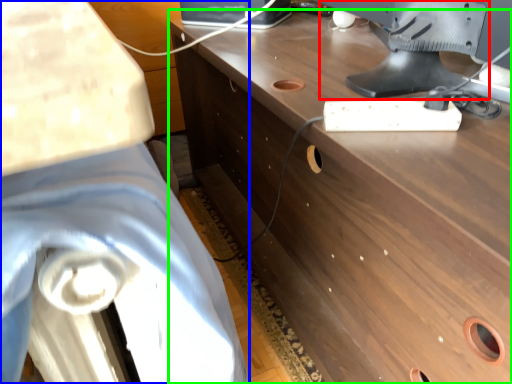
Question: Estimate the real-world distances between objects in this image. Which object is farther from computer monitor (highlighted by a red box), swivel chair (highlighted by a blue box) or desk (highlighted by a green box)?

Choices:
 (A) swivel chair
 (B) desk

Answer: (A)